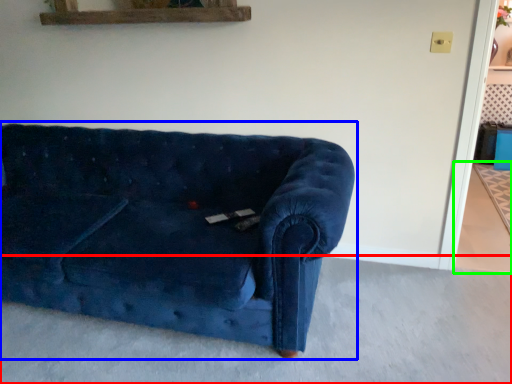
Question: Which is farther away from concrete (highlighted by a red box)? studio couch (highlighted by a blue box) or concrete (highlighted by a green box)?

Choices:
 (A) studio couch
 (B) concrete

Answer: (B)